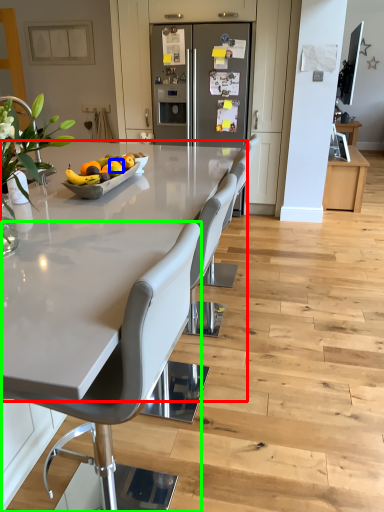
Question: Which object is the farthest from countertop (highlighted by a red box)? Choose among these: orange (highlighted by a blue box) or chair (highlighted by a green box).

Choices:
 (A) orange
 (B) chair

Answer: (A)